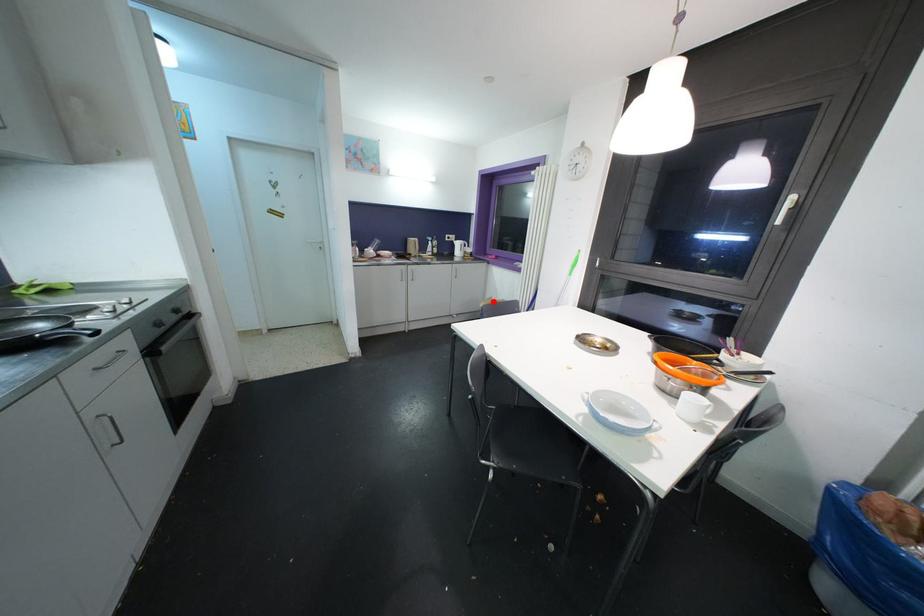
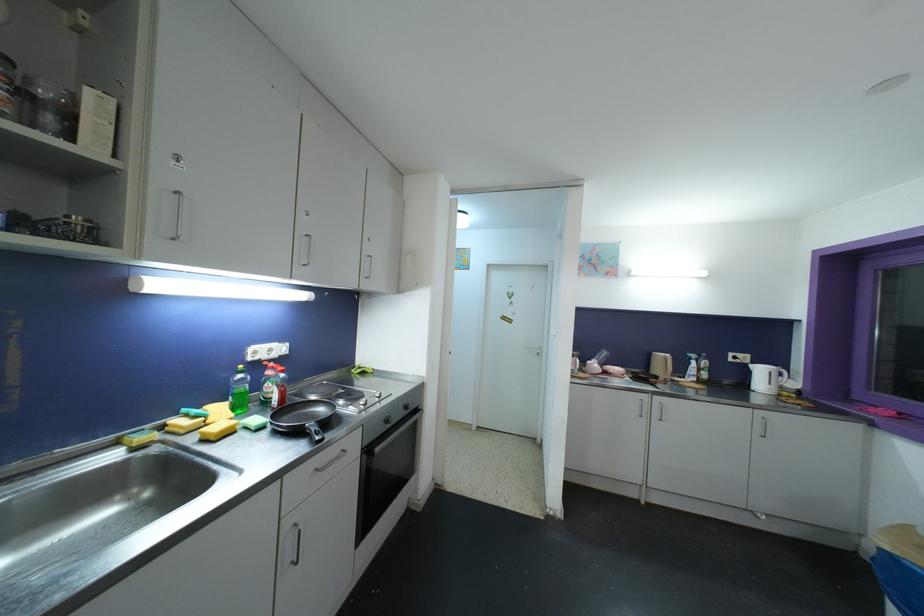
Question: I am providing you with two images of the same scene from different viewpoints. A red point is shown in image1. For the corresponding object point in image2, is it positioned nearer or farther from the camera?

Choices:
 (A) Nearer
 (B) Farther

Answer: (B)